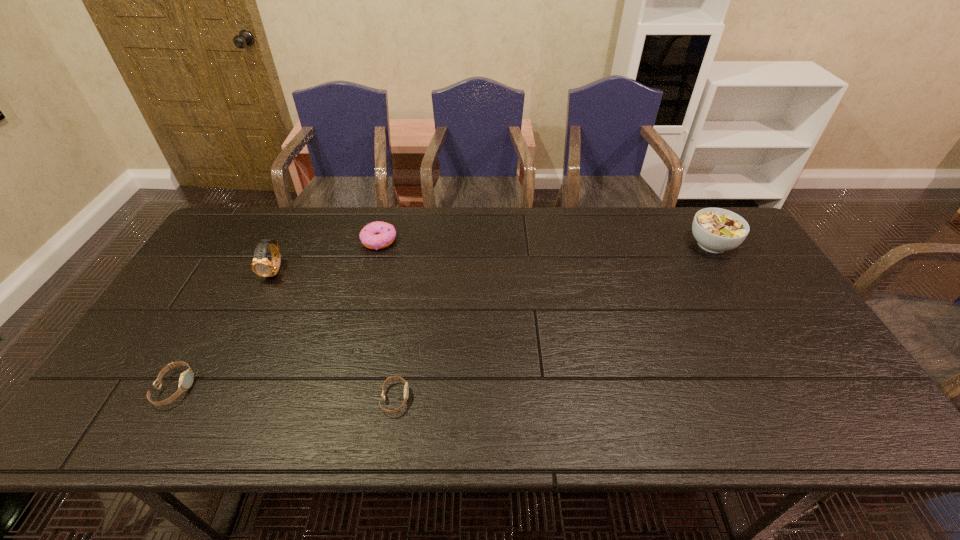
This screenshot has width=960, height=540. Find the location of `the second watch from right to left`. the second watch from right to left is located at coordinates (261, 266).

You are a GUI agent. You are given a task and a screenshot of the screen. Output one action in this format:
    pyautogui.click(x=<x>, y=<y>)
    Task: Click on the farthest watch
    The image size is (960, 540).
    Given the screenshot: What is the action you would take?
    pyautogui.click(x=261, y=266)

Locate an element on the screen. Image resolution: width=960 pixels, height=540 pixels. the fourth shortest object is located at coordinates (716, 230).

Locate an element on the screen. Image resolution: width=960 pixels, height=540 pixels. the rightmost object is located at coordinates (716, 230).

You are a GUI agent. You are given a task and a screenshot of the screen. Output one action in this format:
    pyautogui.click(x=<x>, y=<y>)
    Task: Click on the third object from right to left
    
    Given the screenshot: What is the action you would take?
    pyautogui.click(x=376, y=235)

In order to click on the leftmost watch in this screenshot , I will do `click(186, 378)`.

You are a GUI agent. You are given a task and a screenshot of the screen. Output one action in this format:
    pyautogui.click(x=<x>, y=<y>)
    Task: Click on the second shortest watch
    This screenshot has width=960, height=540.
    Given the screenshot: What is the action you would take?
    pyautogui.click(x=186, y=378)

Locate an element on the screen. the shortest object is located at coordinates (406, 388).

This screenshot has width=960, height=540. Find the location of `the fourth object from left to right`. the fourth object from left to right is located at coordinates (406, 388).

At what (x,y) coordinates should I click in order to perform the action: click on vacant space situated 0.140m on the face of the fourth object from right to left. Please return your answer as a coordinate pair (x, y). The image size is (960, 540). Looking at the image, I should click on (252, 320).